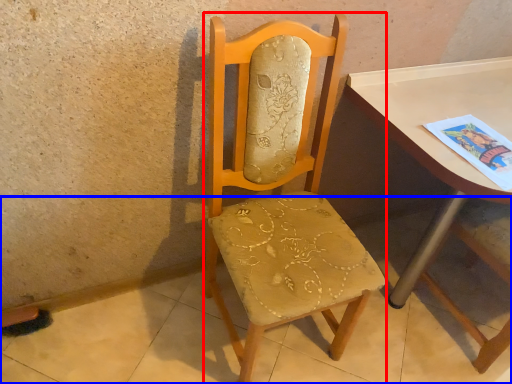
Question: Which object is further to the camera taking this photo, chair (highlighted by a red box) or concrete (highlighted by a blue box)?

Choices:
 (A) chair
 (B) concrete

Answer: (B)